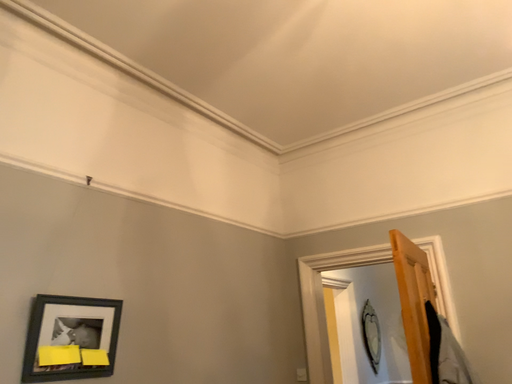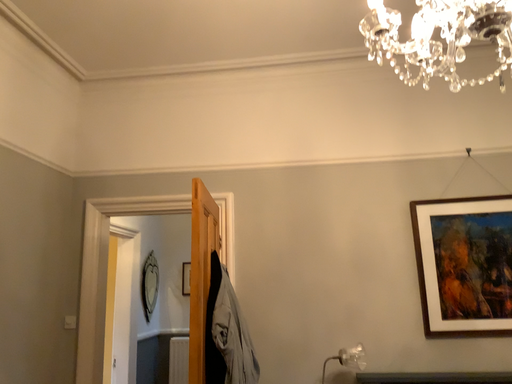
Question: Which way did the camera rotate in the video?

Choices:
 (A) rotated left
 (B) rotated right

Answer: (B)